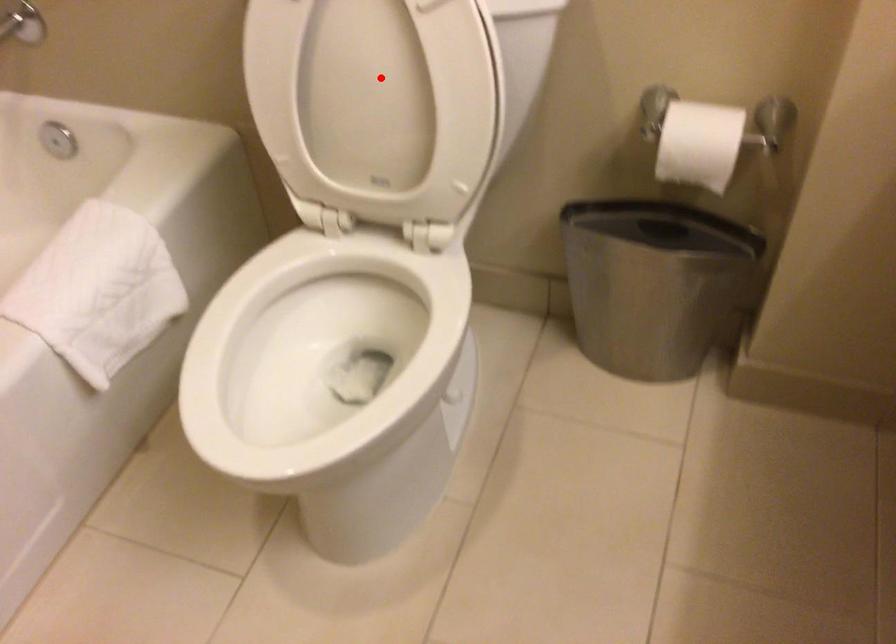
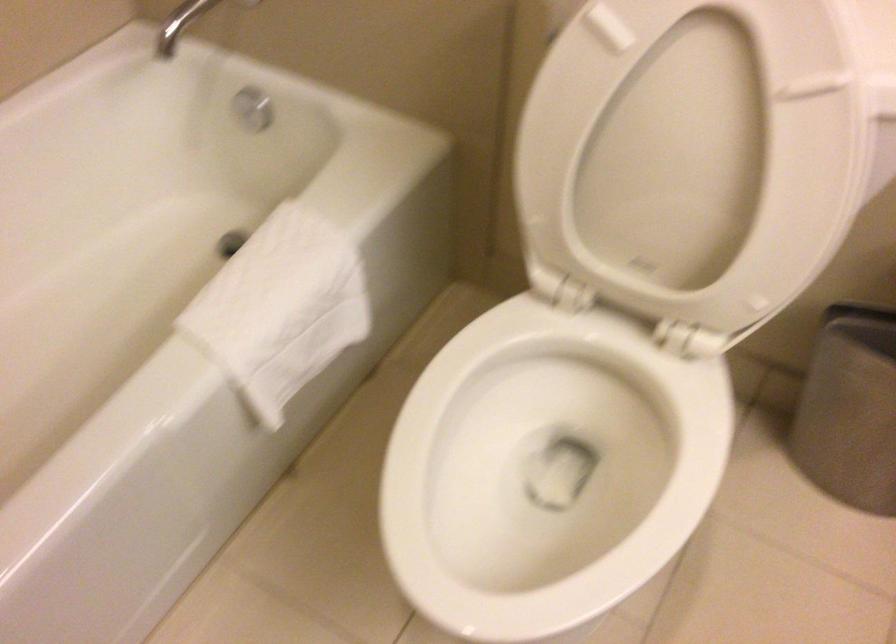
The point at the highlighted location is marked in the first image. Where is the corresponding point in the second image?

(691, 154)